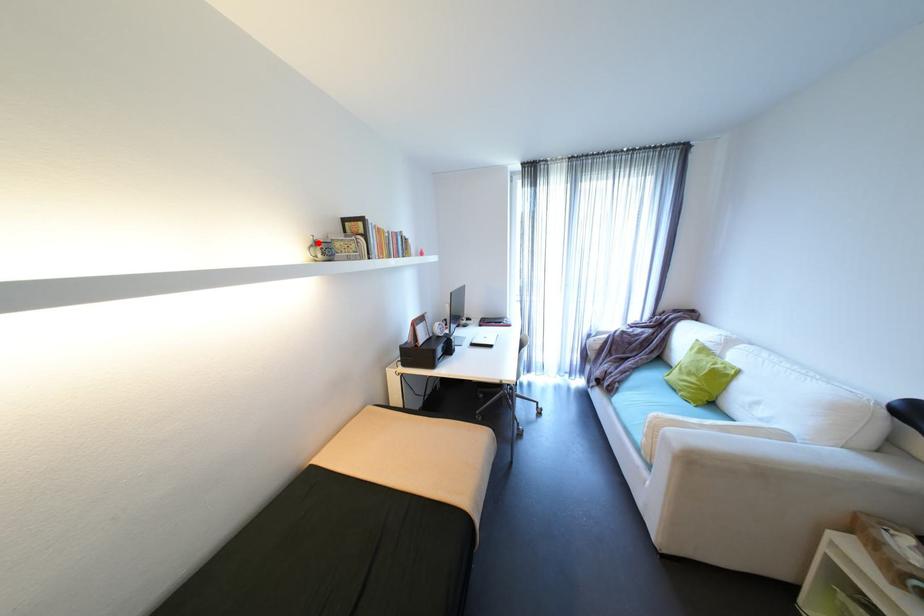
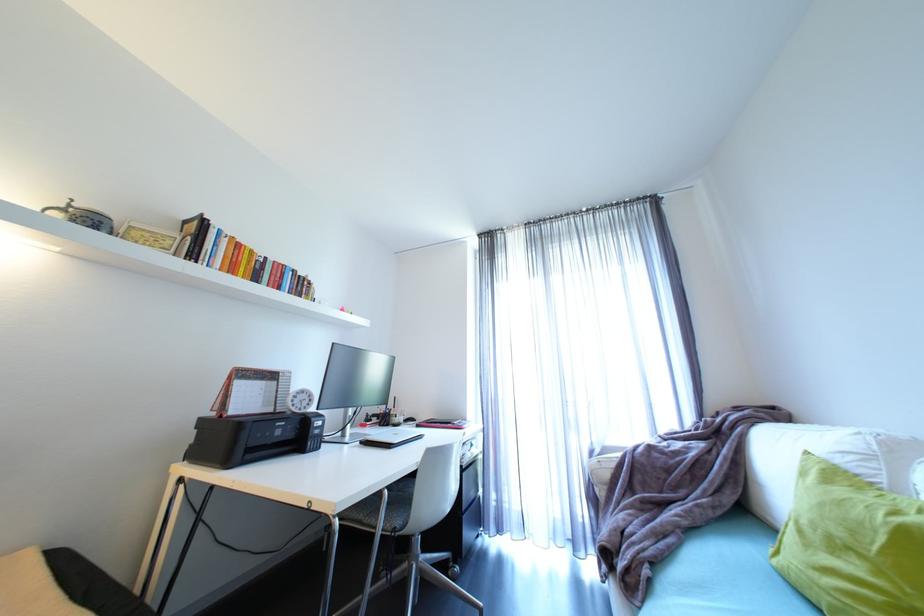
The point at the highlighted location is marked in the first image. Where is the corresponding point in the second image?

(69, 206)